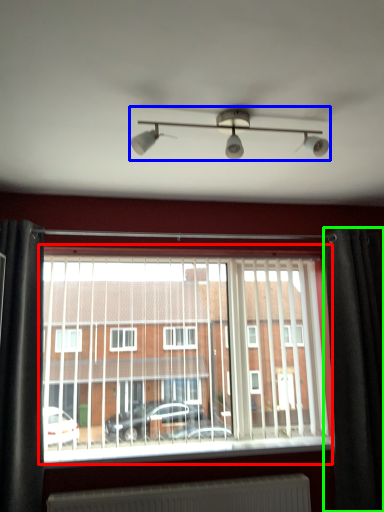
Question: Which is farther away from window (highlighted by a red box)? light fixture (highlighted by a blue box) or curtain (highlighted by a green box)?

Choices:
 (A) light fixture
 (B) curtain

Answer: (A)